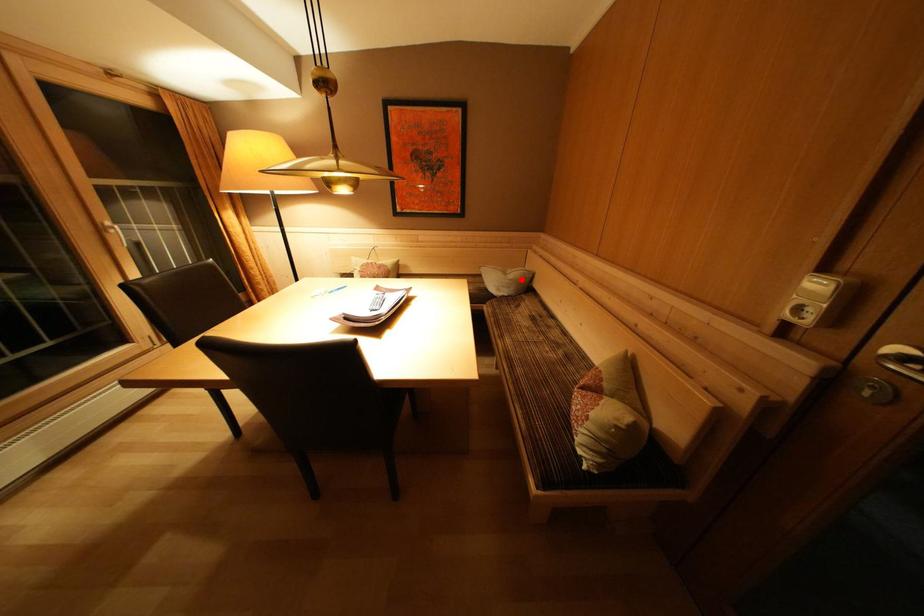
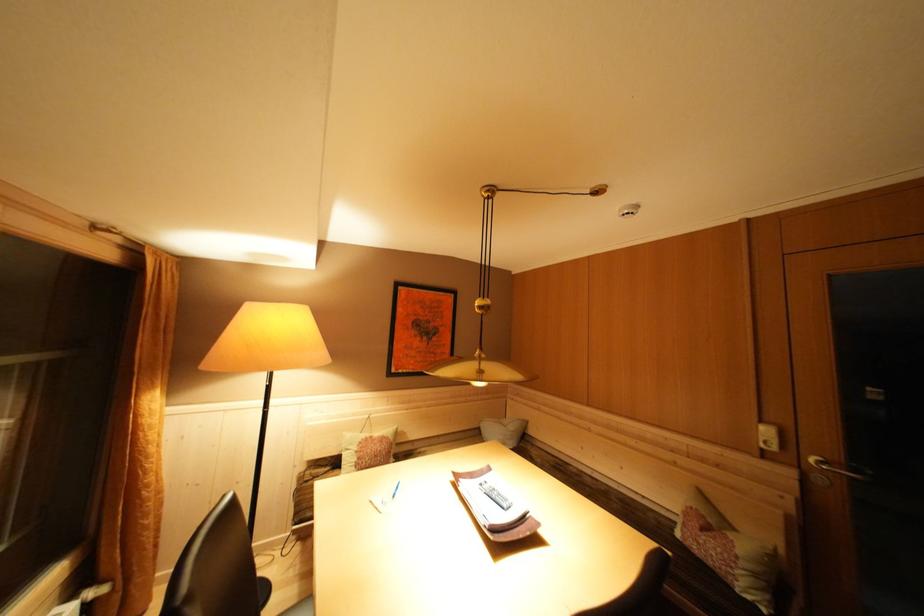
Question: A red point is marked in image1. In image2, is the corresponding 3D point closer to the camera or farther? Reply with the corresponding letter.

Choices:
 (A) The corresponding 3D point is closer.
 (B) The corresponding 3D point is farther.

Answer: (B)